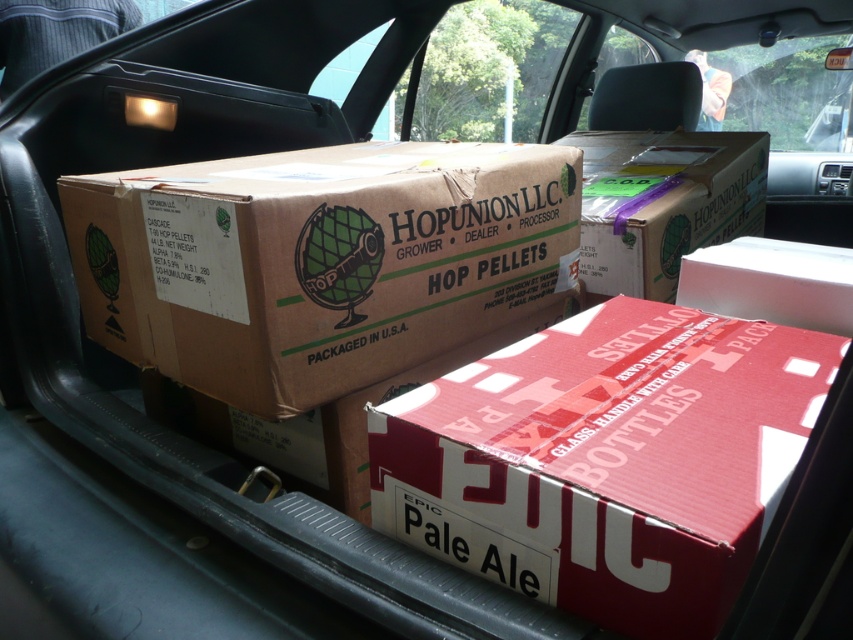
You are moving boxes into a storage room that has a 24 inch wide doorway. You have to carry the red cardboard box at center and the brown cardboard box at upper center. Which box should you carry first through the doorway to ensure both can fit?

The red cardboard box at center has a lesser width compared to brown cardboard box at upper center. Therefore, you should carry the red cardboard box at center first through the doorway since it is narrower and will allow easier passage, ensuring both can fit through the 24 inch wide doorway.

You are a delivery person standing 1 meter away from the car trunk. You need to reach a specific point marked at coordinates point (547, 372) to attach a delivery label. Can you safely reach this point without moving closer than 1 meter?

The distance of point (547, 372) from viewer is 91.11 centimeters. Since you are standing 1 meter away, which is 100 centimeters, the point is closer than your current position. Therefore, you need to move slightly closer to reach it safely.

You are packing boxes into a car trunk and have two boxes to place. The red cardboard box at center and the brown cardboard box at center. Given that the trunk has limited vertical space, which box should you place on top to ensure both fit vertically?

The red cardboard box at center is thinner than the brown cardboard box at center, so placing the red cardboard box at center on top would allow both to fit within the trunk vertically.